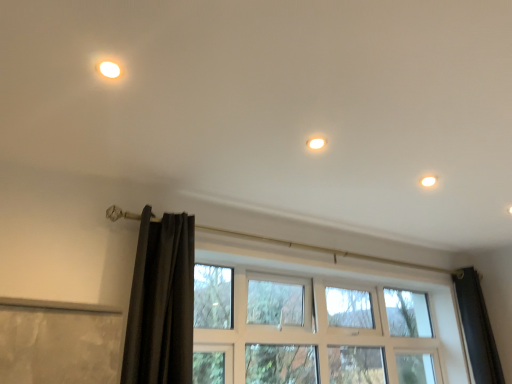
Question: From the image's perspective, is black velvet curtain at left above or below matte white light at upper left?

Choices:
 (A) above
 (B) below

Answer: (B)

Question: Is black velvet curtain at left spatially inside matte white light at upper left, or outside of it?

Choices:
 (A) outside
 (B) inside

Answer: (A)

Question: Based on their relative distances, which object is farther from the black velvet curtain at left?

Choices:
 (A) white glossy light fixture at upper right
 (B) matte white light at upper left
 (C) clear glass window at center

Answer: (A)

Question: Considering the real-world distances, which object is closest to the white glossy light fixture at upper right?

Choices:
 (A) matte white light at upper left
 (B) clear glass window at center
 (C) black velvet curtain at left

Answer: (B)